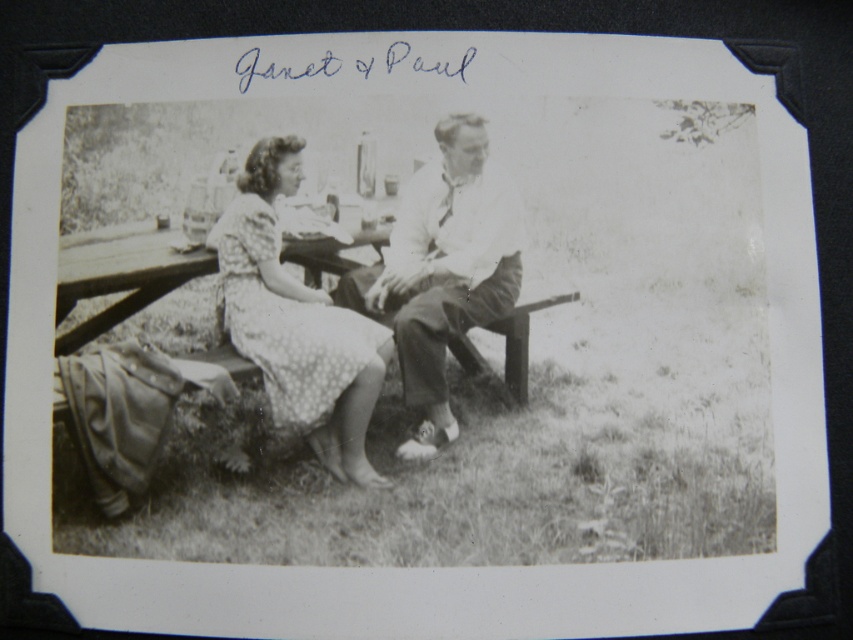
Question: Considering the relative positions of smooth white shirt at center and dotted fabric dress at center-left in the image provided, where is smooth white shirt at center located with respect to dotted fabric dress at center-left?

Choices:
 (A) right
 (B) left

Answer: (A)

Question: Does smooth white shirt at center appear on the left side of dotted fabric dress at center-left?

Choices:
 (A) yes
 (B) no

Answer: (B)

Question: Among these points, which one is nearest to the camera?

Choices:
 (A) (305, 305)
 (B) (442, 449)

Answer: (B)

Question: Can you confirm if smooth white shirt at center is thinner than dotted fabric dress at center-left?

Choices:
 (A) no
 (B) yes

Answer: (A)